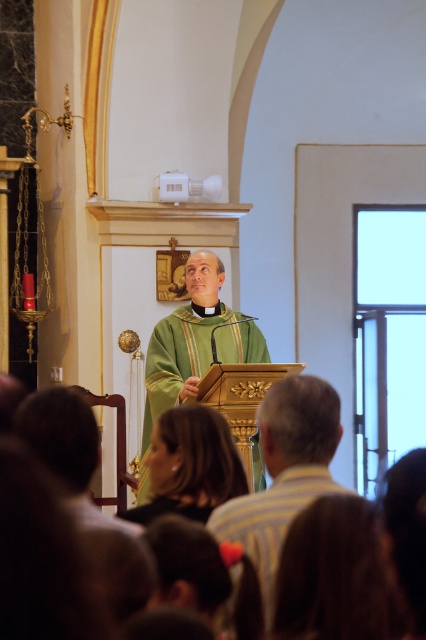
Measure the distance between gold polished lectern at center and green matte vestment at center.

gold polished lectern at center is 10.82 feet from green matte vestment at center.

Is point (268, 579) farther from camera compared to point (250, 324)?

No, (268, 579) is closer to viewer.

What are the coordinates of `gold polished lectern at center` in the screenshot? It's located at (284, 472).